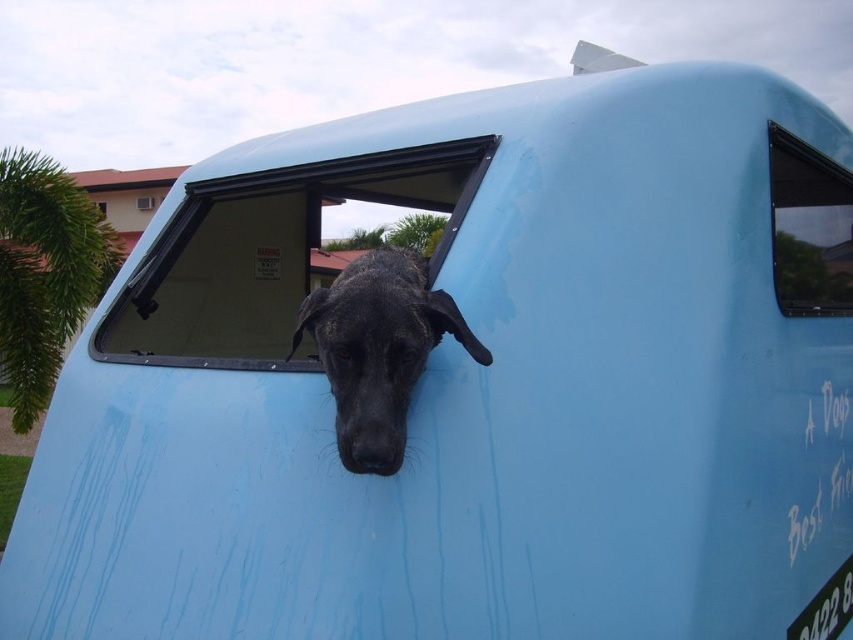
Question: Where is transparent glass window at upper right located in relation to transparent glass window at center in the image?

Choices:
 (A) right
 (B) left

Answer: (A)

Question: Which of the following is the farthest from the observer?

Choices:
 (A) transparent plastic window at center
 (B) black matte dog at center
 (C) transparent glass window at center
 (D) transparent glass window at upper center

Answer: (D)

Question: Does transparent plastic window at center have a larger size compared to transparent glass window at center?

Choices:
 (A) no
 (B) yes

Answer: (A)

Question: Which of the following is the farthest from the observer?

Choices:
 (A) black matte dog at center
 (B) transparent glass window at upper right
 (C) transparent glass window at upper center
 (D) transparent plastic window at center

Answer: (C)

Question: Is transparent plastic window at center thinner than transparent glass window at upper center?

Choices:
 (A) no
 (B) yes

Answer: (A)

Question: Which is nearer to the transparent glass window at upper center?

Choices:
 (A) transparent plastic window at center
 (B) black matte dog at center
 (C) transparent glass window at upper right
 (D) transparent glass window at center

Answer: (D)